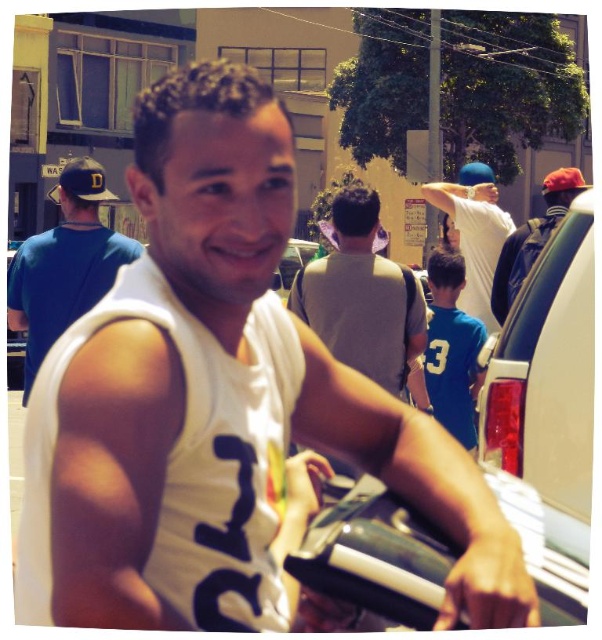
Does gray cotton t-shirt at center appear on the left side of blue cotton t-shirt at left?

Incorrect, gray cotton t-shirt at center is not on the left side of blue cotton t-shirt at left.

Is gray cotton t-shirt at center above blue cotton t-shirt at left?

No, gray cotton t-shirt at center is not above blue cotton t-shirt at left.

At what (x,y) coordinates should I click in order to perform the action: click on gray cotton t-shirt at center. Please return your answer as a coordinate pair (x, y). This screenshot has height=640, width=602. Looking at the image, I should click on (361, 296).

Is metallic silver car at center thinner than gray cotton t-shirt at center?

Indeed, metallic silver car at center has a lesser width compared to gray cotton t-shirt at center.

Who is more forward, (x=529, y=305) or (x=335, y=208)?

Point (x=529, y=305) is in front.

Find the location of a particular element. This screenshot has width=602, height=640. metallic silver car at center is located at coordinates (542, 428).

Between metallic silver car at center and blue cotton t-shirt at left, which one has more height?

With more height is blue cotton t-shirt at left.

Who is positioned more to the left, metallic silver car at center or blue cotton t-shirt at left?

blue cotton t-shirt at left

Identify the location of metallic silver car at center. (542, 428).